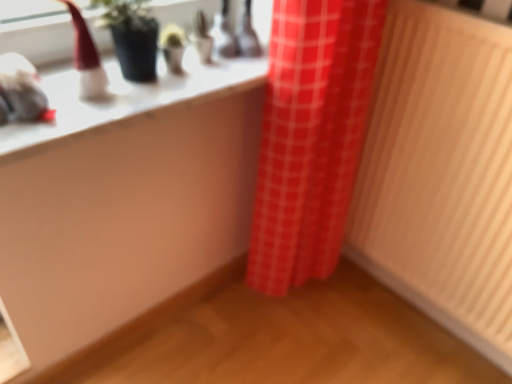
Question: From a real-world perspective, does red checkered curtain at center stand above white glossy counter top at upper left?

Choices:
 (A) yes
 (B) no

Answer: (B)

Question: Can you confirm if red checkered curtain at center is positioned to the right of white glossy counter top at upper left?

Choices:
 (A) yes
 (B) no

Answer: (A)

Question: Does red checkered curtain at center appear on the left side of white glossy counter top at upper left?

Choices:
 (A) no
 (B) yes

Answer: (A)

Question: Does red checkered curtain at center turn towards white glossy counter top at upper left?

Choices:
 (A) yes
 (B) no

Answer: (B)

Question: From the image's perspective, is red checkered curtain at center above white glossy counter top at upper left?

Choices:
 (A) yes
 (B) no

Answer: (B)

Question: Is red checkered curtain at center inside or outside of white glossy counter top at upper left?

Choices:
 (A) inside
 (B) outside

Answer: (B)

Question: Visually, is red checkered curtain at center positioned to the left or to the right of white glossy counter top at upper left?

Choices:
 (A) right
 (B) left

Answer: (A)

Question: From the image's perspective, is red checkered curtain at center positioned above or below white glossy counter top at upper left?

Choices:
 (A) below
 (B) above

Answer: (A)

Question: Looking at their shapes, would you say red checkered curtain at center is wider or thinner than white glossy counter top at upper left?

Choices:
 (A) wide
 (B) thin

Answer: (B)

Question: Considering the positions of wooden radiator at right and white glossy counter top at upper left in the image, is wooden radiator at right wider or thinner than white glossy counter top at upper left?

Choices:
 (A) thin
 (B) wide

Answer: (A)

Question: From the image's perspective, is wooden radiator at right above or below white glossy counter top at upper left?

Choices:
 (A) below
 (B) above

Answer: (A)

Question: Is wooden radiator at right spatially inside white glossy counter top at upper left, or outside of it?

Choices:
 (A) outside
 (B) inside

Answer: (A)

Question: Is wooden radiator at right taller or shorter than white glossy counter top at upper left?

Choices:
 (A) tall
 (B) short

Answer: (A)

Question: Is point (366, 264) closer or farther from the camera than point (323, 124)?

Choices:
 (A) closer
 (B) farther

Answer: (B)

Question: Is wooden radiator at right wider or thinner than red checkered curtain at center?

Choices:
 (A) wide
 (B) thin

Answer: (B)